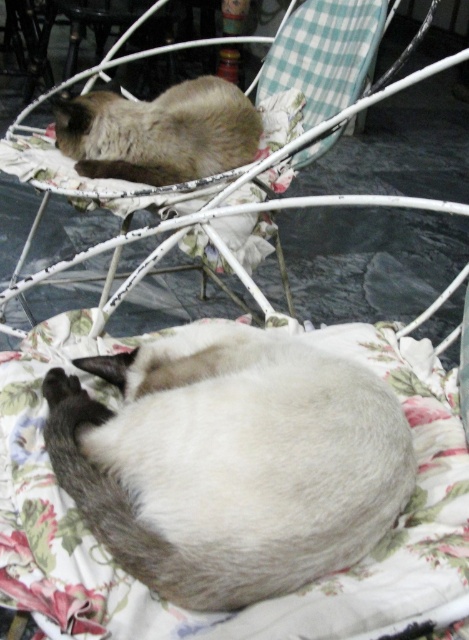
You are standing on the patio and want to place a small toy between the two points labeled point [227,132] and point [335,72]. Which point is closer to you so the toy can be placed near it?

Point [227,132] is closer to you than point [335,72], so placing the toy near point [227,132] would be closer to your position.

You are a cat owner who wants to place a small food bowl between the smokey gray fur at upper left and the fluffy fabric chair at upper center. The bowl requires 12 inches of space to fit. Can you fit the bowl between them?

The distance between the smokey gray fur at upper left and the fluffy fabric chair at upper center is 13.69 inches, which is more than enough to fit the 12 inches required for the food bowl.

You are a cat owner who wants to place a new cat tree in the patio. The cat tree requires 1.2 meters of space. Based on the image, is there enough space between the silky white cat at center and the fluffy fabric chair at upper center to place the cat tree?

The distance between the silky white cat at center and the fluffy fabric chair at upper center is 1.10 meters, which is less than the required 1.2 meters. Therefore, there is not enough space to place the cat tree between them.